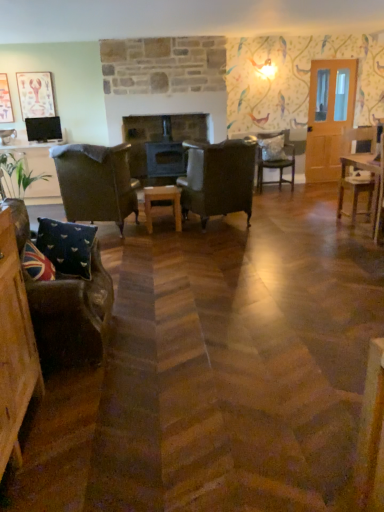
Question: Is wooden picture frame at upper left, the second picture frame from the right, spatially inside velvet union jack pillow at lower left, marked as the second pillow in a left-to-right arrangement, or outside of it?

Choices:
 (A) outside
 (B) inside

Answer: (A)

Question: Considering the positions of wooden picture frame at upper left, the second picture frame from the right, and velvet union jack pillow at lower left, which appears as the 2th pillow when viewed from the right, in the image, is wooden picture frame at upper left, the second picture frame from the right, bigger or smaller than velvet union jack pillow at lower left, which appears as the 2th pillow when viewed from the right,?

Choices:
 (A) big
 (B) small

Answer: (B)

Question: Based on their relative distances, which object is nearer to the brown leather armchair at left, placed as the first chair when sorted from left to right?

Choices:
 (A) velvet dark brown armchair at lower left, the fourth chair positioned from the right
 (B) velvet cushioned chair at center, which is the 2th chair from right to left
 (C) wooden chair at right, the 4th chair viewed from the front
 (D) union jack fabric pillow at lower left, which ranks as the first pillow in left-to-right order
 (E) wooden table at center

Answer: (E)

Question: Which object is the closest to the leather armchair at center, which is counted as the 2th chair, starting from the front?

Choices:
 (A) wooden table at center
 (B) white fabric pillow at center, arranged as the 1th pillow when viewed from the back
 (C) union jack fabric pillow at lower left, which ranks as the first pillow in left-to-right order
 (D) matte pink picture frame at upper left, placed as the 2th picture frame when sorted from left to right
 (E) velvet union jack pillow at lower left, which is the second pillow in top-to-bottom order

Answer: (A)